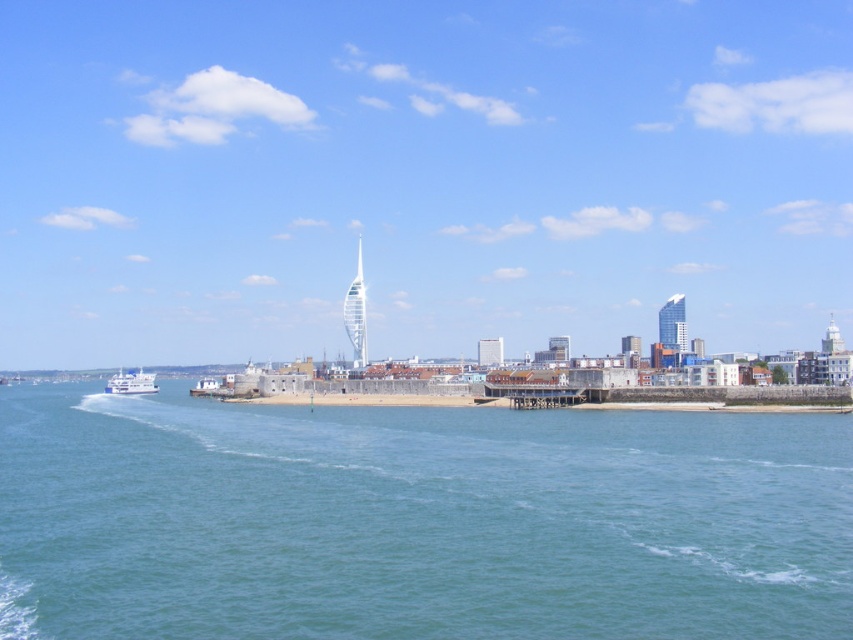
Question: Among these objects, which one is farthest from the camera?

Choices:
 (A) transparent glass skyline at center
 (B) clear blue water at lower center
 (C) white glossy ferry at lower left

Answer: (A)

Question: Is clear blue water at lower center bigger than white glossy ferry at lower left?

Choices:
 (A) yes
 (B) no

Answer: (A)

Question: Which of the following is the closest to the observer?

Choices:
 (A) transparent glass skyline at center
 (B) clear blue water at lower center
 (C) white glossy ferry at lower left

Answer: (B)

Question: Is transparent glass skyline at center wider than white glossy ferry at lower left?

Choices:
 (A) no
 (B) yes

Answer: (B)

Question: Which of the following is the closest to the observer?

Choices:
 (A) (143, 378)
 (B) (248, 420)

Answer: (B)

Question: Is transparent glass skyline at center positioned at the back of clear blue water at lower center?

Choices:
 (A) yes
 (B) no

Answer: (A)